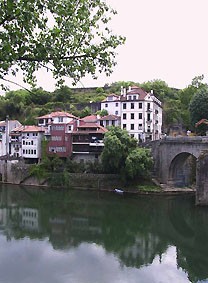
Where is `chimneys`? chimneys is located at coordinates (6, 127), (77, 122), (121, 91), (124, 93), (131, 87), (152, 92).